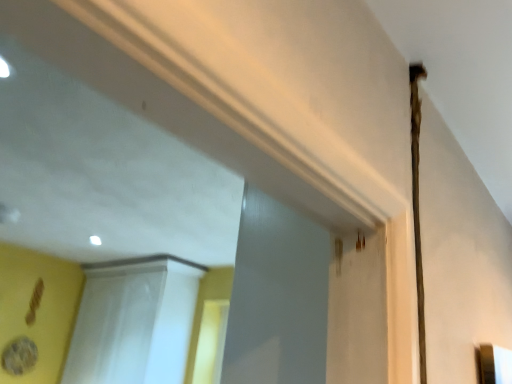
Identify the location of white translucent screen door at center. Image resolution: width=512 pixels, height=384 pixels. (115, 324).

This screenshot has height=384, width=512. What do you see at coordinates (115, 324) in the screenshot?
I see `white translucent screen door at center` at bounding box center [115, 324].

Measure the distance between white translucent screen door at center and camera.

A distance of 2.45 meters exists between white translucent screen door at center and camera.

What are the coordinates of `white translucent screen door at center` in the screenshot? It's located at pyautogui.click(x=115, y=324).